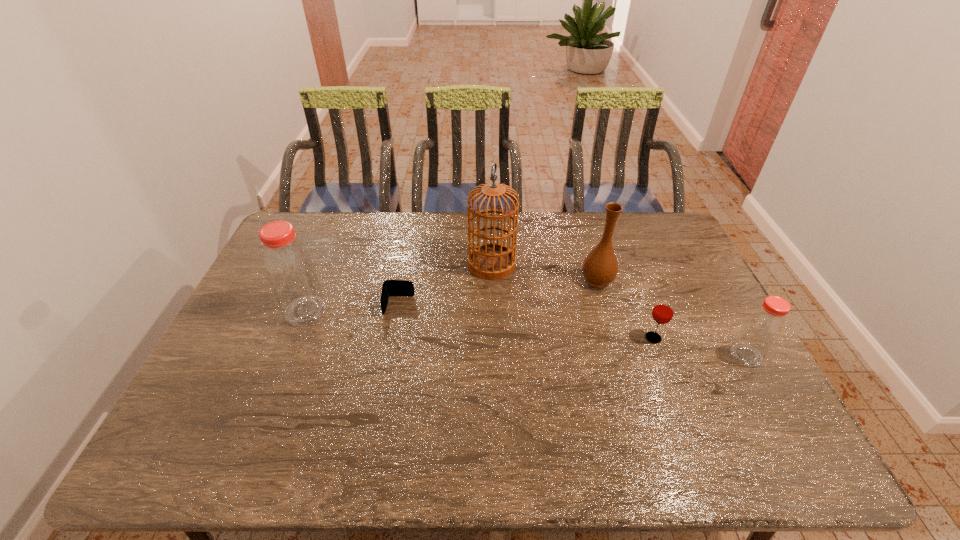
At what (x,y) coordinates should I click in order to perform the action: click on the farther bottle. Please return your answer as a coordinate pair (x, y). The image size is (960, 540). Looking at the image, I should click on (289, 268).

Image resolution: width=960 pixels, height=540 pixels. What are the coordinates of `the taller bottle` in the screenshot? It's located at click(289, 268).

Image resolution: width=960 pixels, height=540 pixels. In order to click on the right bottle in this screenshot , I will do click(x=760, y=332).

The height and width of the screenshot is (540, 960). Identify the location of the nearer bottle. (760, 332).

Locate an element on the screen. The image size is (960, 540). birdcage is located at coordinates (492, 261).

I want to click on the tallest object, so click(492, 261).

The width and height of the screenshot is (960, 540). I want to click on the second shortest object, so click(x=663, y=311).

Find the location of a particular element. The image size is (960, 540). glass is located at coordinates (663, 311).

Where is `vase`? The width and height of the screenshot is (960, 540). vase is located at coordinates [x=600, y=267].

Find the location of a particular element. The image size is (960, 540). the fifth object from right to left is located at coordinates (390, 287).